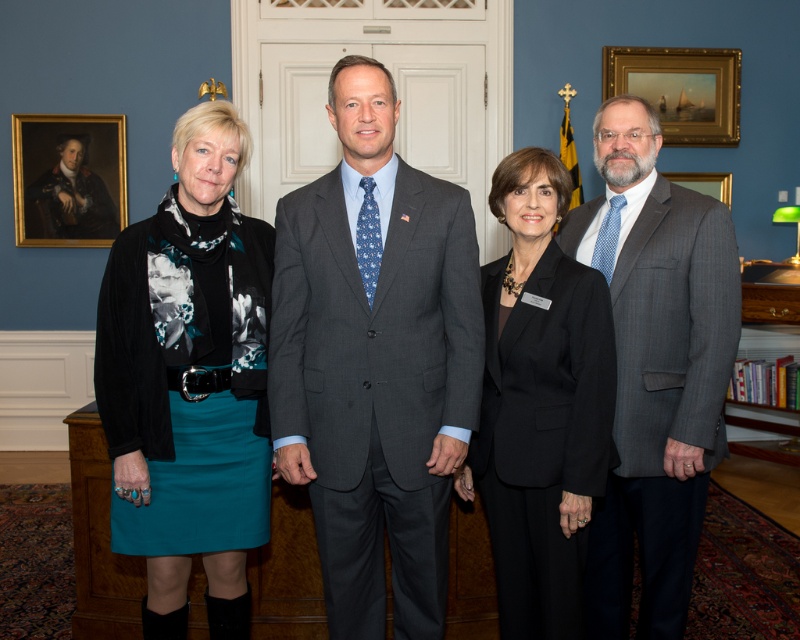
Question: From the image, what is the correct spatial relationship of teal fabric skirt at left in relation to wooden portrait frame at upper left?

Choices:
 (A) below
 (B) above

Answer: (A)

Question: Which object appears closest to the camera in this image?

Choices:
 (A) black matte suit at center
 (B) wooden picture frame at right
 (C) gray pinstripe suit at right
 (D) gold wooden picture frame at upper right

Answer: (A)

Question: Can you confirm if black matte suit at center is bigger than wooden portrait frame at upper left?

Choices:
 (A) yes
 (B) no

Answer: (A)

Question: Can you confirm if wooden portrait frame at upper left is wider than gold wooden picture frame at upper right?

Choices:
 (A) no
 (B) yes

Answer: (A)

Question: Which point is farther to the camera?

Choices:
 (A) (710, 109)
 (B) (545, 188)
 (C) (678, 180)
 (D) (60, 225)

Answer: (C)

Question: Based on their relative distances, which object is nearer to the gold wooden picture frame at upper right?

Choices:
 (A) black matte suit at center
 (B) wooden portrait frame at upper left
 (C) teal fabric skirt at left
 (D) wooden picture frame at right

Answer: (D)